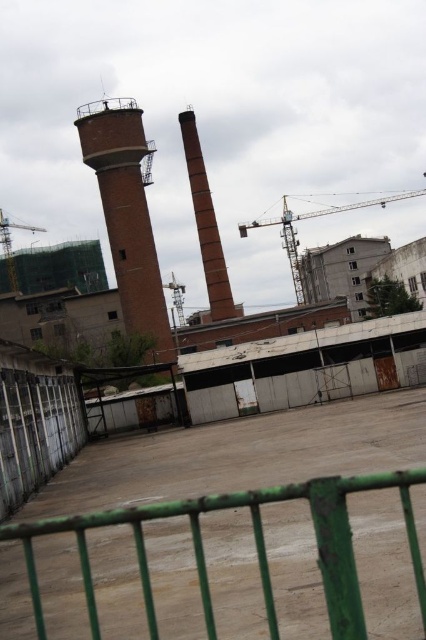
You are standing at the green metal fence in the industrial area. You see two points marked in the scene. Which point is closer to you, point (307, 211) or point (23, 228)?

Point (23, 228) is closer to you because the description states that point (307, 211) is behind point (23, 228).

You are standing at the green metal fence in the foreground of the industrial area. You need to move towards the yellow metallic crane at center. Which direction should you walk to reach it?

The yellow metallic crane at center is located at point 0.341 on the horizontal axis and 0.737 on the vertical axis. Since you are at the green metal fence in the foreground, which is the front part of the scene, you should walk forward towards the center of the image to reach the crane.